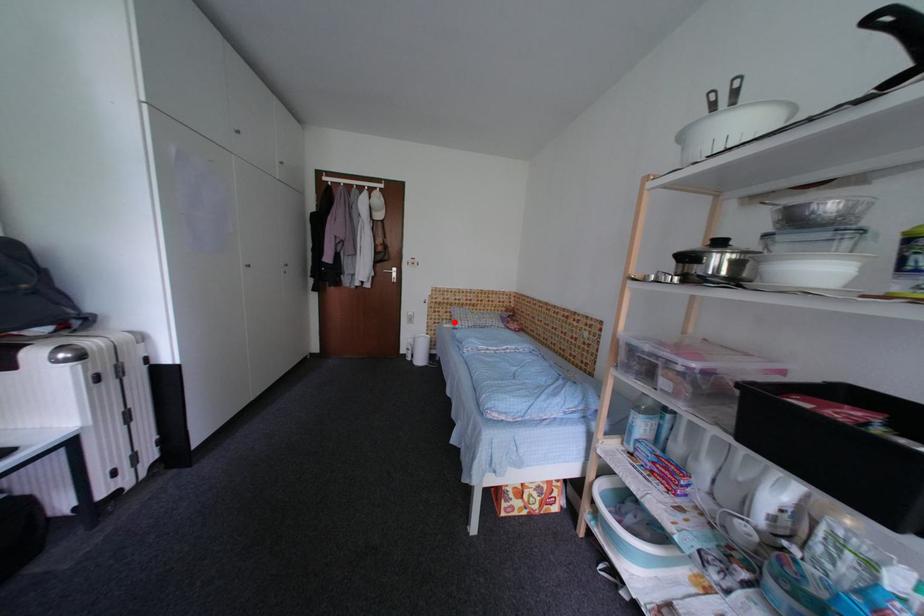
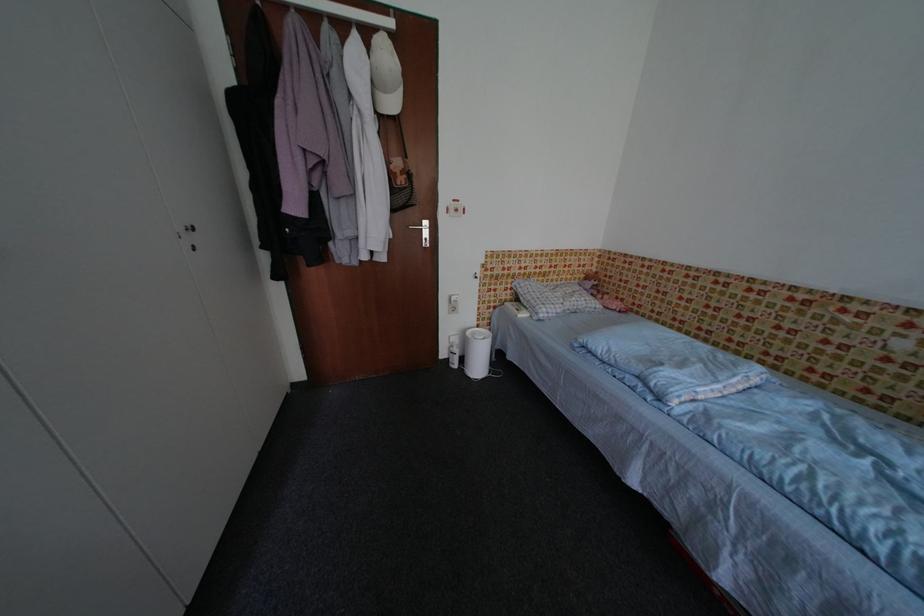
In the second image, find the point that corresponds to the highlighted location in the first image.

(514, 302)